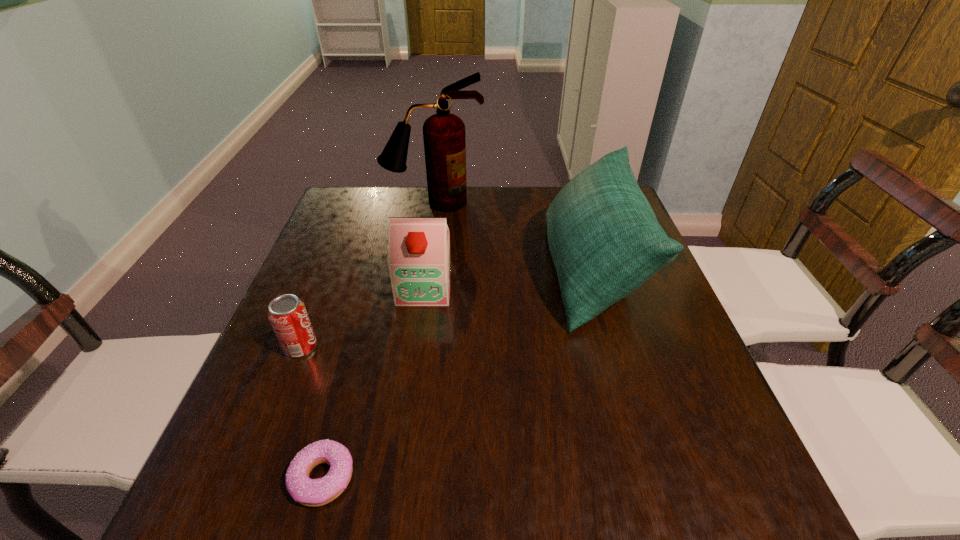
Identify the location of vacant space at the near right corner of the desktop. (722, 499).

I want to click on free space between the fire extinguisher and the doughnut, so click(378, 340).

This screenshot has height=540, width=960. Identify the location of vacant space that's between the soda can and the tallest object. (368, 275).

You are a GUI agent. You are given a task and a screenshot of the screen. Output one action in this format:
    pyautogui.click(x=<x>, y=<y>)
    Task: Click on the free area in between the leftmost object and the third shortest object
    
    Given the screenshot: What is the action you would take?
    pyautogui.click(x=363, y=318)

Locate an element on the screen. The height and width of the screenshot is (540, 960). free spot between the soya milk and the fourth tallest object is located at coordinates (363, 318).

At what (x,y) coordinates should I click in order to perform the action: click on vacant point located between the rightmost object and the soya milk. Please return your answer as a coordinate pair (x, y). This screenshot has width=960, height=540. Looking at the image, I should click on (508, 279).

Locate an element on the screen. The width and height of the screenshot is (960, 540). vacant space that's between the soya milk and the doughnut is located at coordinates (373, 382).

At what (x,y) coordinates should I click in order to perform the action: click on free space between the tallest object and the doughnut. Please return your answer as a coordinate pair (x, y). The height and width of the screenshot is (540, 960). Looking at the image, I should click on (378, 340).

This screenshot has height=540, width=960. Identify the location of vacant region between the soda can and the second tallest object. (446, 309).

Locate an element on the screen. The height and width of the screenshot is (540, 960). vacant space that's between the farthest object and the leftmost object is located at coordinates (368, 275).